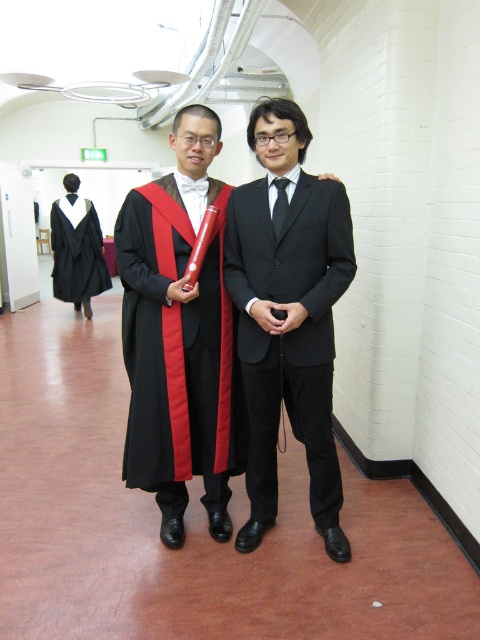
Question: Which object is the closest to the black matte graduation gown at left?

Choices:
 (A) matte black graduation gown at center
 (B) black satin suit at center

Answer: (A)

Question: Can you confirm if matte black graduation gown at center is positioned to the right of black matte graduation gown at left?

Choices:
 (A) yes
 (B) no

Answer: (A)

Question: Which object is positioned farthest from the black satin suit at center?

Choices:
 (A) black matte graduation gown at left
 (B) matte black graduation gown at center

Answer: (A)

Question: Estimate the real-world distances between objects in this image. Which object is farther from the black matte graduation gown at left?

Choices:
 (A) matte black graduation gown at center
 (B) black satin suit at center

Answer: (B)

Question: Can you confirm if black satin suit at center is positioned above black matte graduation gown at left?

Choices:
 (A) yes
 (B) no

Answer: (B)

Question: Can you confirm if black satin suit at center is thinner than matte black graduation gown at center?

Choices:
 (A) yes
 (B) no

Answer: (A)